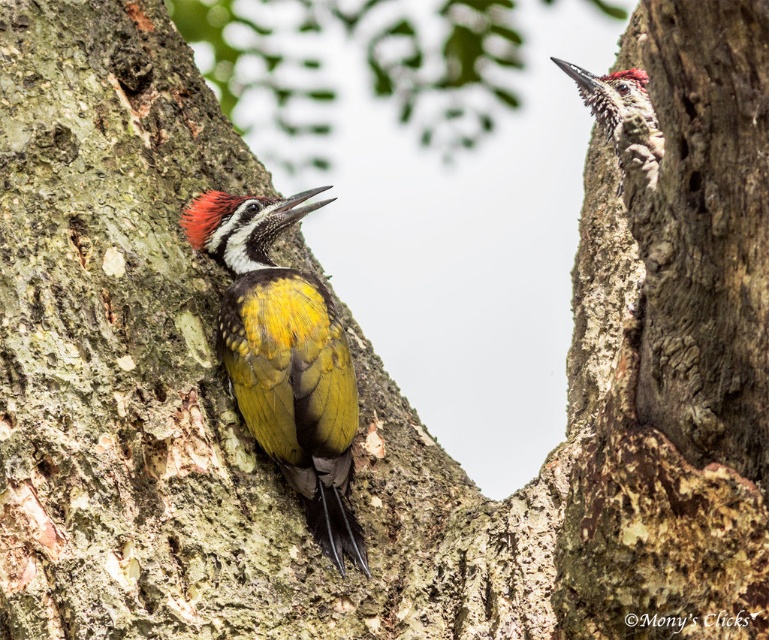
Question: From the image, what is the correct spatial relationship of yellow-green woodpecker at center in relation to yellow-green woodpecker at upper right?

Choices:
 (A) below
 (B) above

Answer: (A)

Question: Does yellow-green woodpecker at center have a lesser width compared to yellow-green woodpecker at upper right?

Choices:
 (A) yes
 (B) no

Answer: (B)

Question: Which of the following is the farthest from the observer?

Choices:
 (A) yellow-green woodpecker at center
 (B) yellow-green woodpecker at upper right

Answer: (A)

Question: Can you confirm if yellow-green woodpecker at center is positioned to the right of yellow-green woodpecker at upper right?

Choices:
 (A) no
 (B) yes

Answer: (A)

Question: Which point is closer to the camera?

Choices:
 (A) (232, 212)
 (B) (647, 122)

Answer: (B)